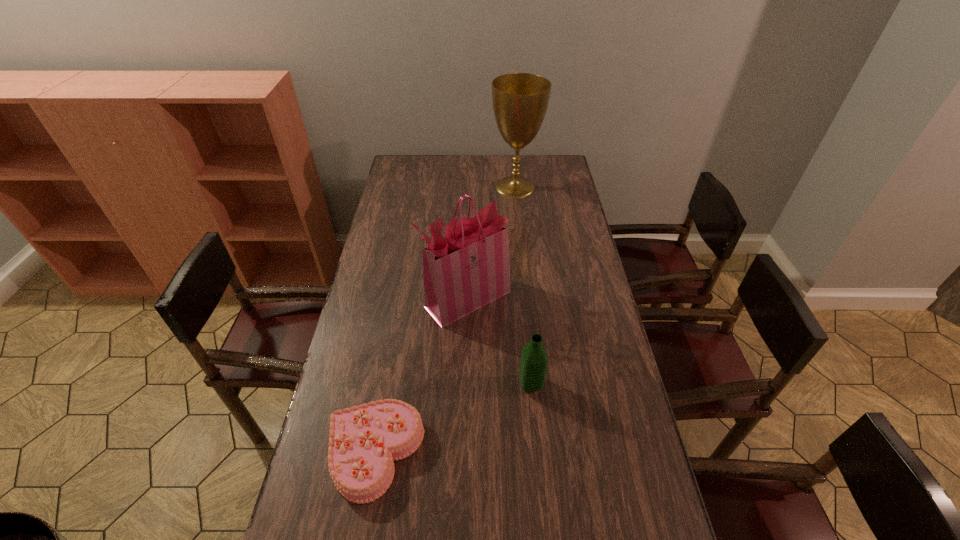
The image size is (960, 540). I want to click on object that is positioned at the far edge, so click(520, 100).

You are a GUI agent. You are given a task and a screenshot of the screen. Output one action in this format:
    pyautogui.click(x=<x>, y=<y>)
    Task: Click on the object positioned at the left edge
    This screenshot has width=960, height=540.
    Given the screenshot: What is the action you would take?
    pyautogui.click(x=365, y=440)

Locate an element on the screen. object that is at the right edge is located at coordinates [x=520, y=100].

The image size is (960, 540). Identify the location of object that is at the far right corner. (520, 100).

Where is `vacant space at the far edge`? The height and width of the screenshot is (540, 960). vacant space at the far edge is located at coordinates pos(459,168).

Identify the location of vacant space at the left edge of the desktop. (336, 381).

Locate an element on the screen. free point at the right edge is located at coordinates (581, 227).

In the image, there is a desktop. In order to click on vacant space at the far left corner in this screenshot , I will do `click(398, 167)`.

This screenshot has height=540, width=960. Identify the location of free area in between the water bottle and the shortest object. (453, 418).

Locate an element on the screen. free space between the water bottle and the cake is located at coordinates (453, 418).